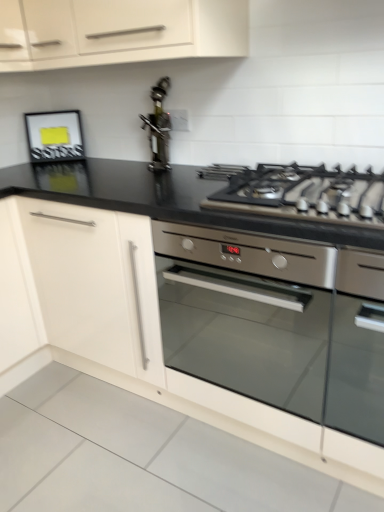
Question: Is white matte cabinet at upper left, placed as the 2th cabinetry when sorted from bottom to top, far from stainless steel oil dispenser at center?

Choices:
 (A) no
 (B) yes

Answer: (A)

Question: Can you confirm if white matte cabinet at upper left, arranged as the 1th cabinetry when viewed from the top, is shorter than stainless steel oil dispenser at center?

Choices:
 (A) yes
 (B) no

Answer: (A)

Question: Considering the relative sizes of white matte cabinet at upper left, placed as the 2th cabinetry when sorted from bottom to top, and stainless steel oil dispenser at center in the image provided, is white matte cabinet at upper left, placed as the 2th cabinetry when sorted from bottom to top, bigger than stainless steel oil dispenser at center?

Choices:
 (A) yes
 (B) no

Answer: (A)

Question: Is white matte cabinet at upper left, placed as the 2th cabinetry when sorted from bottom to top, at the left side of stainless steel oil dispenser at center?

Choices:
 (A) yes
 (B) no

Answer: (A)

Question: From a real-world perspective, is white matte cabinet at upper left, arranged as the 1th cabinetry when viewed from the top, on stainless steel oil dispenser at center?

Choices:
 (A) yes
 (B) no

Answer: (A)

Question: Is point (72, 159) positioned closer to the camera than point (140, 312)?

Choices:
 (A) farther
 (B) closer

Answer: (A)

Question: Considering the positions of matte black frame at upper left and white matte cabinet at left, the 2th cabinetry positioned from the top, in the image, is matte black frame at upper left bigger or smaller than white matte cabinet at left, the 2th cabinetry positioned from the top,?

Choices:
 (A) small
 (B) big

Answer: (A)

Question: Visually, is matte black frame at upper left positioned to the left or to the right of white matte cabinet at left, the 2th cabinetry positioned from the top?

Choices:
 (A) right
 (B) left

Answer: (A)

Question: Is matte black frame at upper left taller or shorter than white matte cabinet at left, the 2th cabinetry positioned from the top?

Choices:
 (A) tall
 (B) short

Answer: (B)

Question: From a real-world perspective, is stainless steel oil dispenser at center positioned above or below white matte cabinet at upper left, arranged as the 1th cabinetry when viewed from the top?

Choices:
 (A) above
 (B) below

Answer: (B)

Question: Based on their positions, is stainless steel oil dispenser at center located to the left or right of white matte cabinet at upper left, arranged as the 1th cabinetry when viewed from the top?

Choices:
 (A) right
 (B) left

Answer: (A)

Question: Choose the correct answer: Is stainless steel oil dispenser at center inside white matte cabinet at upper left, placed as the 2th cabinetry when sorted from bottom to top, or outside it?

Choices:
 (A) outside
 (B) inside

Answer: (A)

Question: Is point (157, 97) closer or farther from the camera than point (147, 10)?

Choices:
 (A) farther
 (B) closer

Answer: (A)

Question: Is white matte cabinet at left, the 2th cabinetry positioned from the top, bigger or smaller than stainless steel oil dispenser at center?

Choices:
 (A) small
 (B) big

Answer: (B)

Question: From the image's perspective, relative to stainless steel oil dispenser at center, is white matte cabinet at left, the first cabinetry positioned from the bottom, above or below?

Choices:
 (A) above
 (B) below

Answer: (B)